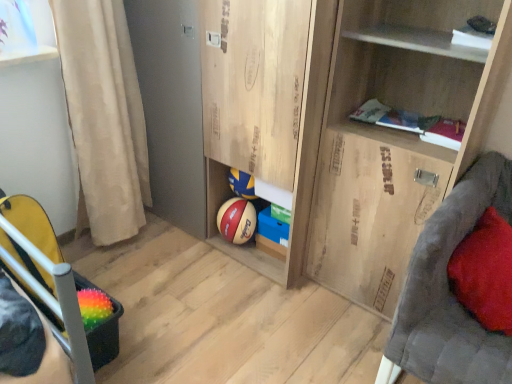
Question: Does beige fabric curtain at left have a larger size compared to rubber textured basketball at lower left?

Choices:
 (A) no
 (B) yes

Answer: (B)

Question: Is beige fabric curtain at left aimed at rubber textured basketball at lower left?

Choices:
 (A) yes
 (B) no

Answer: (B)

Question: Is beige fabric curtain at left to the left of rubber textured basketball at lower left from the viewer's perspective?

Choices:
 (A) no
 (B) yes

Answer: (B)

Question: From the image's perspective, is beige fabric curtain at left under rubber textured basketball at lower left?

Choices:
 (A) yes
 (B) no

Answer: (B)

Question: Considering the relative sizes of beige fabric curtain at left and rubber textured basketball at lower left in the image provided, is beige fabric curtain at left shorter than rubber textured basketball at lower left?

Choices:
 (A) yes
 (B) no

Answer: (B)

Question: Looking at their shapes, would you say wooden cupboard at upper right is wider or thinner than red velvet pillow at right?

Choices:
 (A) wide
 (B) thin

Answer: (A)

Question: Is wooden cupboard at upper right spatially inside red velvet pillow at right, or outside of it?

Choices:
 (A) inside
 (B) outside

Answer: (B)

Question: From the image's perspective, is wooden cupboard at upper right located above or below red velvet pillow at right?

Choices:
 (A) above
 (B) below

Answer: (A)

Question: Relative to red velvet pillow at right, is wooden cupboard at upper right in front or behind?

Choices:
 (A) front
 (B) behind

Answer: (A)

Question: Looking at their shapes, would you say wooden cupboard at upper right is wider or thinner than beige fabric curtain at left?

Choices:
 (A) wide
 (B) thin

Answer: (A)

Question: From a real-world perspective, is wooden cupboard at upper right positioned above or below beige fabric curtain at left?

Choices:
 (A) below
 (B) above

Answer: (B)

Question: Considering the positions of wooden cupboard at upper right and beige fabric curtain at left in the image, is wooden cupboard at upper right taller or shorter than beige fabric curtain at left?

Choices:
 (A) short
 (B) tall

Answer: (B)

Question: Do you think wooden cupboard at upper right is within beige fabric curtain at left, or outside of it?

Choices:
 (A) outside
 (B) inside

Answer: (A)

Question: From their relative heights in the image, would you say beige fabric curtain at left is taller or shorter than wooden cupboard at upper right?

Choices:
 (A) tall
 (B) short

Answer: (B)

Question: Would you say beige fabric curtain at left is inside or outside wooden cupboard at upper right?

Choices:
 (A) outside
 (B) inside

Answer: (A)